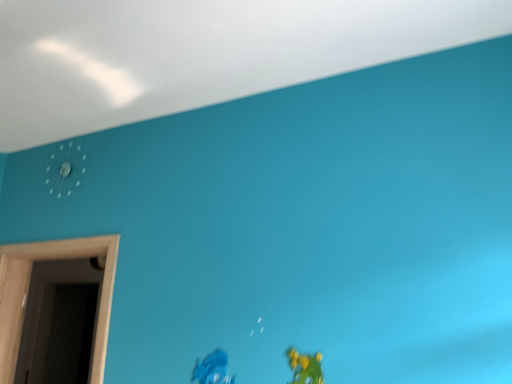
At what (x,y) coordinates should I click in order to perform the action: click on wooden door at left. Please return your answer as a coordinate pair (x, y). Looking at the image, I should click on (27, 294).

At what (x,y) coordinates should I click in order to perform the action: click on wooden door at left. Please return your answer as a coordinate pair (x, y). Image resolution: width=512 pixels, height=384 pixels. Looking at the image, I should click on (27, 294).

Is matte blue toy at lower center, arranged as the second toy when viewed from the front, positioned with its back to wooden door at left?

No, matte blue toy at lower center, arranged as the second toy when viewed from the front, is not facing the opposite direction of wooden door at left.

From the picture: Between matte blue toy at lower center, the 2th toy when ordered from right to left, and wooden door at left, which one has smaller width?

With smaller width is matte blue toy at lower center, the 2th toy when ordered from right to left.

Considering the sizes of matte blue toy at lower center, which ranks as the first toy in back-to-front order, and wooden door at left in the image, is matte blue toy at lower center, which ranks as the first toy in back-to-front order, bigger or smaller than wooden door at left?

Clearly, matte blue toy at lower center, which ranks as the first toy in back-to-front order, is smaller in size than wooden door at left.

Which is in front, matte green toy at lower right, the first toy positioned from the front, or white plastic clock at upper left?

Positioned in front is matte green toy at lower right, the first toy positioned from the front.

Consider the image. Would you say matte green toy at lower right, the first toy positioned from the front, contains white plastic clock at upper left?

Definitely not — white plastic clock at upper left is not inside matte green toy at lower right, the first toy positioned from the front.

In terms of height, does matte green toy at lower right, positioned as the 2th toy in left-to-right order, look taller or shorter compared to white plastic clock at upper left?

Considering their sizes, matte green toy at lower right, positioned as the 2th toy in left-to-right order, has less height than white plastic clock at upper left.

Is white plastic clock at upper left not near wooden door at left?

white plastic clock at upper left is actually quite close to wooden door at left.

At what (x,y) coordinates should I click in order to perform the action: click on clock above the wooden door at left (from the image's perspective). Please return your answer as a coordinate pair (x, y). Looking at the image, I should click on (65, 169).

Does white plastic clock at upper left appear on the right side of wooden door at left?

In fact, white plastic clock at upper left is to the left of wooden door at left.

Which object is closer to the camera, wooden door at left or matte blue toy at lower center, arranged as the second toy when viewed from the front?

matte blue toy at lower center, arranged as the second toy when viewed from the front, is closer to the camera.

Can matte blue toy at lower center, arranged as the second toy when viewed from the front, be found inside wooden door at left?

Definitely not — matte blue toy at lower center, arranged as the second toy when viewed from the front, is not inside wooden door at left.

Is wooden door at left thinner than matte blue toy at lower center, arranged as the second toy when viewed from the front?

Incorrect, the width of wooden door at left is not less than that of matte blue toy at lower center, arranged as the second toy when viewed from the front.

Where is `window that is behind the matte blue toy at lower center, which ranks as the first toy in back-to-front order`? This screenshot has height=384, width=512. window that is behind the matte blue toy at lower center, which ranks as the first toy in back-to-front order is located at coordinates (27, 294).

Can you tell me how much matte green toy at lower right, the second toy in the back-to-front sequence, and matte blue toy at lower center, which ranks as the first toy in back-to-front order, differ in facing direction?

The angular difference between matte green toy at lower right, the second toy in the back-to-front sequence, and matte blue toy at lower center, which ranks as the first toy in back-to-front order, is 0.004 degrees.

Is there a large distance between matte green toy at lower right, the second toy in the back-to-front sequence, and matte blue toy at lower center, which is the first toy from left to right?

They are positioned close to each other.

In the scene shown: Which is more to the right, matte green toy at lower right, positioned as the 2th toy in left-to-right order, or matte blue toy at lower center, the 2th toy when ordered from right to left?

matte green toy at lower right, positioned as the 2th toy in left-to-right order.

Is matte green toy at lower right, the second toy in the back-to-front sequence, not inside matte blue toy at lower center, arranged as the second toy when viewed from the front?

matte green toy at lower right, the second toy in the back-to-front sequence, is positioned outside matte blue toy at lower center, arranged as the second toy when viewed from the front.

Does matte blue toy at lower center, the 2th toy when ordered from right to left, touch white plastic clock at upper left?

No, matte blue toy at lower center, the 2th toy when ordered from right to left, is not touching white plastic clock at upper left.

From a real-world perspective, is matte blue toy at lower center, arranged as the second toy when viewed from the front, positioned above or below white plastic clock at upper left?

From a real-world perspective, matte blue toy at lower center, arranged as the second toy when viewed from the front, is physically below white plastic clock at upper left.

In the scene shown: Would you say matte blue toy at lower center, the 2th toy when ordered from right to left, is outside white plastic clock at upper left?

Indeed, matte blue toy at lower center, the 2th toy when ordered from right to left, is completely outside white plastic clock at upper left.

Considering the positions of points (203, 364) and (82, 171), is point (203, 364) farther from camera compared to point (82, 171)?

No, it is in front of (82, 171).

Considering the positions of objects wooden door at left and white plastic clock at upper left in the image provided, who is more to the right, wooden door at left or white plastic clock at upper left?

Positioned to the right is wooden door at left.

I want to click on clock on the left of wooden door at left, so click(65, 169).

Would you say wooden door at left contains white plastic clock at upper left?

No, white plastic clock at upper left is not a part of wooden door at left.

In the image, there is a wooden door at left. At what (x,y) coordinates should I click in order to perform the action: click on toy below it (from the image's perspective). Please return your answer as a coordinate pair (x, y). Looking at the image, I should click on (213, 369).

This screenshot has height=384, width=512. Find the location of `clock above the matte green toy at lower right, the second toy in the back-to-front sequence (from a real-world perspective)`. clock above the matte green toy at lower right, the second toy in the back-to-front sequence (from a real-world perspective) is located at coordinates (65, 169).

Looking at the image, which one is located closer to wooden door at left, matte blue toy at lower center, which ranks as the first toy in back-to-front order, or matte green toy at lower right, which is counted as the first toy, starting from the right?

matte blue toy at lower center, which ranks as the first toy in back-to-front order, lies closer to wooden door at left than the other object.

Looking at the image, which one is located further to matte green toy at lower right, which is counted as the first toy, starting from the right, matte blue toy at lower center, which ranks as the first toy in back-to-front order, or wooden door at left?

wooden door at left is positioned further to the anchor matte green toy at lower right, which is counted as the first toy, starting from the right.

Estimate the real-world distances between objects in this image. Which object is further from matte green toy at lower right, positioned as the 2th toy in left-to-right order, wooden door at left or white plastic clock at upper left?

Among the two, white plastic clock at upper left is located further to matte green toy at lower right, positioned as the 2th toy in left-to-right order.

When comparing their distances from white plastic clock at upper left, does wooden door at left or matte green toy at lower right, the first toy positioned from the front, seem closer?

wooden door at left is positioned closer to the anchor white plastic clock at upper left.

Which object lies further to the anchor point matte blue toy at lower center, arranged as the second toy when viewed from the front, matte green toy at lower right, positioned as the 2th toy in left-to-right order, or white plastic clock at upper left?

Based on the image, white plastic clock at upper left appears to be further to matte blue toy at lower center, arranged as the second toy when viewed from the front.

Based on their spatial positions, is white plastic clock at upper left or matte blue toy at lower center, arranged as the second toy when viewed from the front, further from matte green toy at lower right, the first toy positioned from the front?

Based on the image, white plastic clock at upper left appears to be further to matte green toy at lower right, the first toy positioned from the front.

From the image, which object appears to be farther from wooden door at left, matte green toy at lower right, the second toy in the back-to-front sequence, or white plastic clock at upper left?

Based on the image, matte green toy at lower right, the second toy in the back-to-front sequence, appears to be further to wooden door at left.

Which object lies nearer to the anchor point wooden door at left, matte green toy at lower right, the second toy in the back-to-front sequence, or matte blue toy at lower center, which is the first toy from left to right?

Among the two, matte blue toy at lower center, which is the first toy from left to right, is located nearer to wooden door at left.

This screenshot has width=512, height=384. In order to click on window between white plastic clock at upper left and matte blue toy at lower center, arranged as the second toy when viewed from the front, in the horizontal direction in this screenshot , I will do [27, 294].

I want to click on toy between white plastic clock at upper left and matte green toy at lower right, which is counted as the first toy, starting from the right, so click(213, 369).

You are a GUI agent. You are given a task and a screenshot of the screen. Output one action in this format:
    pyautogui.click(x=<x>, y=<y>)
    Task: Click on the window located between white plastic clock at upper left and matte green toy at lower right, positioned as the 2th toy in left-to-right order, in the left-right direction
    The width and height of the screenshot is (512, 384).
    Given the screenshot: What is the action you would take?
    pyautogui.click(x=27, y=294)

I want to click on toy situated between wooden door at left and matte green toy at lower right, which is counted as the first toy, starting from the right, from left to right, so click(213, 369).